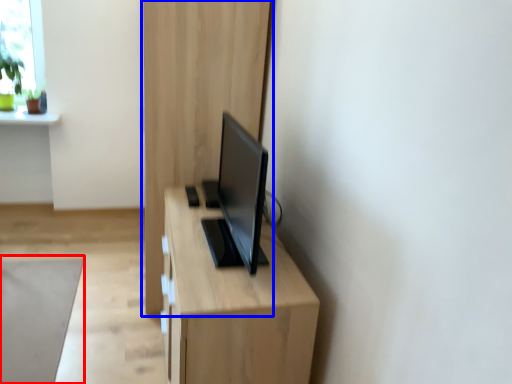
Question: Which object appears farthest to the camera in this image, plain (highlighted by a red box) or dresser (highlighted by a blue box)?

Choices:
 (A) plain
 (B) dresser

Answer: (B)